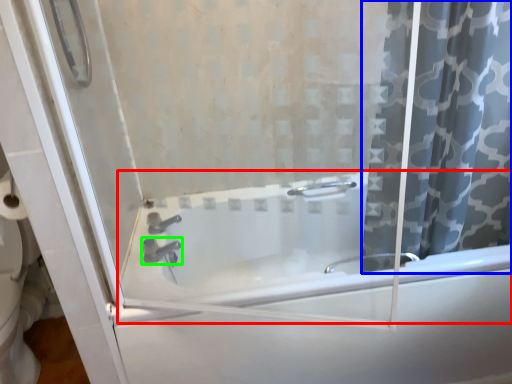
Question: Which is farther away from bathtub (highlighted by a red box)? curtain (highlighted by a blue box) or tap (highlighted by a green box)?

Choices:
 (A) curtain
 (B) tap

Answer: (B)